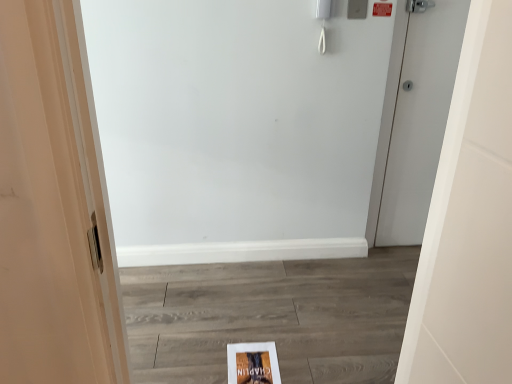
Question: Does point (416, 206) appear closer or farther from the camera than point (245, 367)?

Choices:
 (A) closer
 (B) farther

Answer: (B)

Question: Is white matte door at right inside or outside of matte paper flyer at center?

Choices:
 (A) inside
 (B) outside

Answer: (B)

Question: Is white matte door at right in front of or behind matte paper flyer at center in the image?

Choices:
 (A) front
 (B) behind

Answer: (B)

Question: Is matte paper flyer at center inside or outside of white matte door at right?

Choices:
 (A) inside
 (B) outside

Answer: (B)

Question: Is point (241, 374) closer or farther from the camera than point (440, 92)?

Choices:
 (A) farther
 (B) closer

Answer: (B)

Question: Considering the positions of matte paper flyer at center and white matte door at right in the image, is matte paper flyer at center bigger or smaller than white matte door at right?

Choices:
 (A) small
 (B) big

Answer: (A)

Question: Is matte paper flyer at center wider or thinner than white matte door at right?

Choices:
 (A) thin
 (B) wide

Answer: (B)